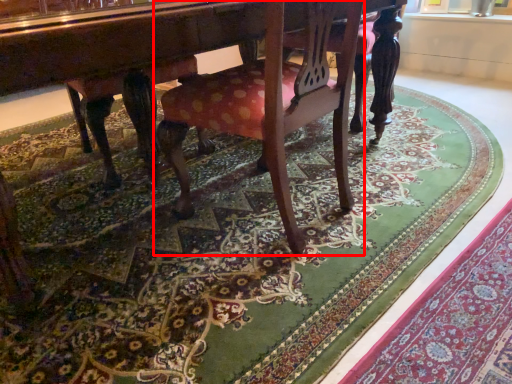
Question: From the image's perspective, what is the correct spatial relationship of chair (annotated by the red box) in relation to mat?

Choices:
 (A) above
 (B) below

Answer: (A)